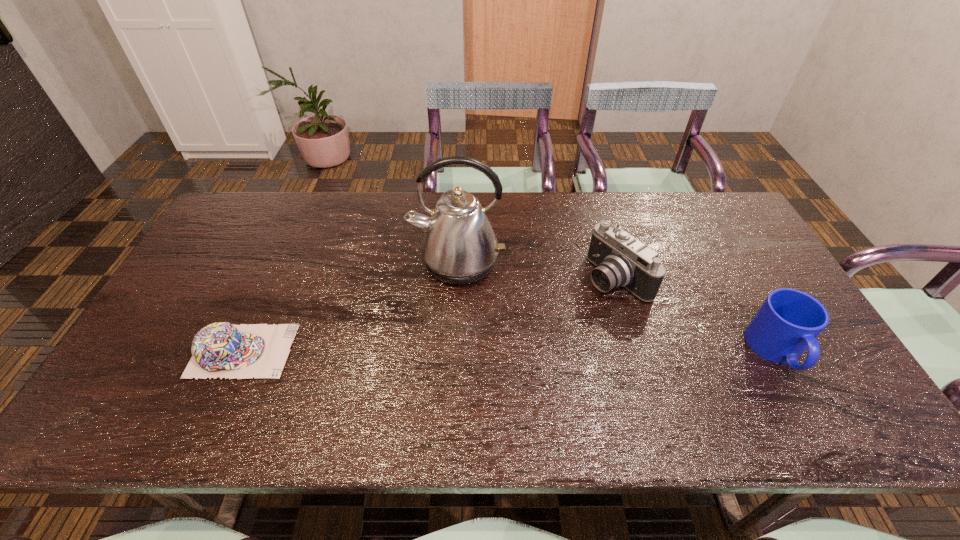
The height and width of the screenshot is (540, 960). Find the location of `free spot on the desktop that is between the shortest object and the rightmost object and is positioned on the front-facing side of the third object from left to right`. free spot on the desktop that is between the shortest object and the rightmost object and is positioned on the front-facing side of the third object from left to right is located at coordinates (498, 351).

What are the coordinates of `free space on the desktop that is between the cap and the mug and is positioned from the spout of the kettle` in the screenshot? It's located at (461, 351).